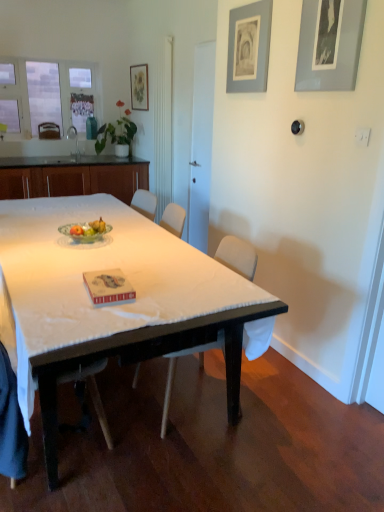
Locate an element on the screen. This screenshot has height=512, width=384. free location to the left of green glass bowl at center is located at coordinates pos(38,239).